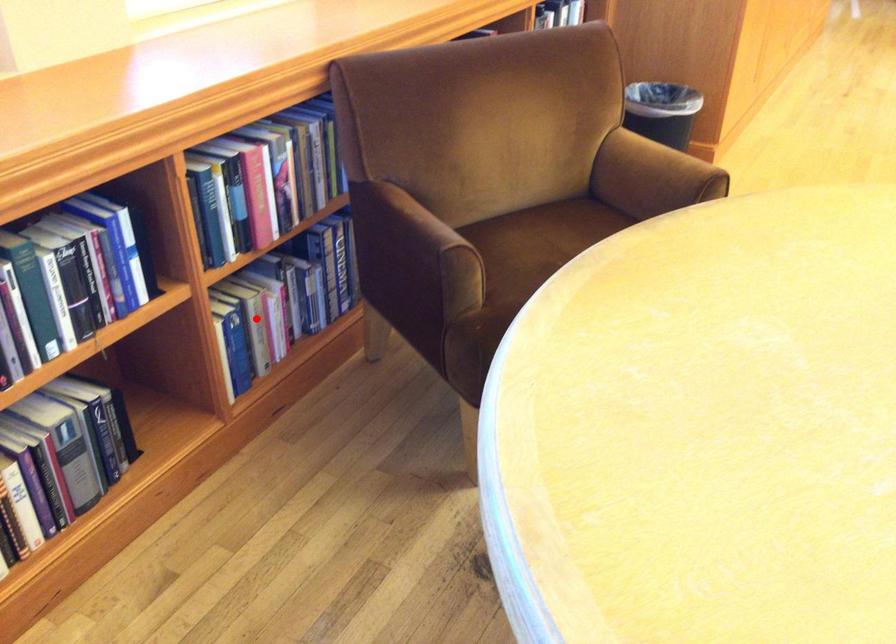
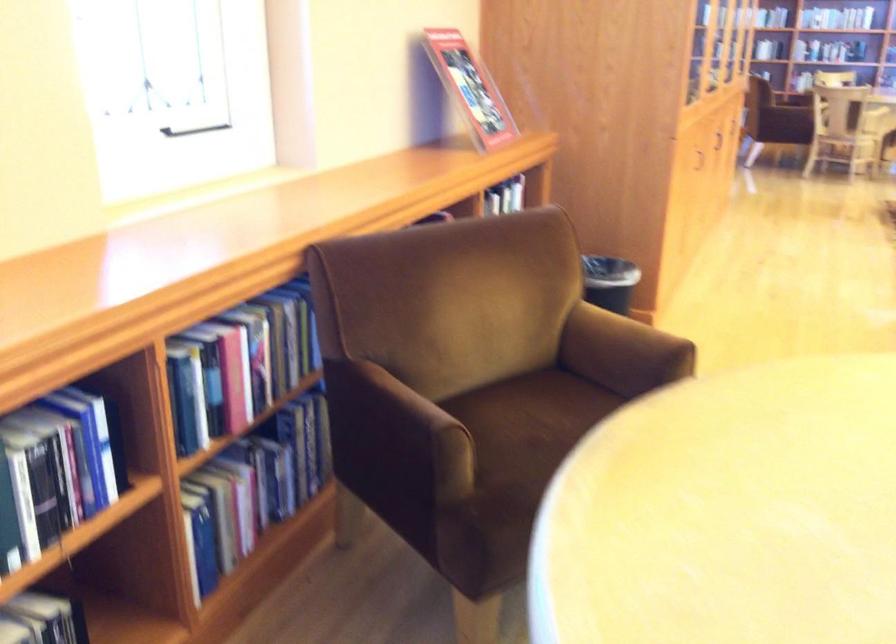
Find the pixel in the second image that matches the highlighted location in the first image.

(227, 511)